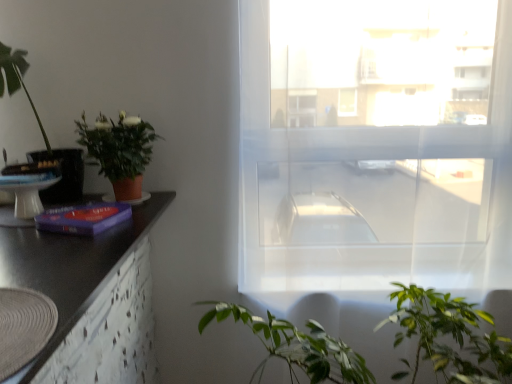
Question: From the image's perspective, does transparent fabric window at center appear higher than purple matte book at left?

Choices:
 (A) yes
 (B) no

Answer: (A)

Question: Is the depth of transparent fabric window at center greater than that of purple matte book at left?

Choices:
 (A) no
 (B) yes

Answer: (B)

Question: Does transparent fabric window at center appear on the right side of purple matte book at left?

Choices:
 (A) no
 (B) yes

Answer: (B)

Question: Is transparent fabric window at center aimed at purple matte book at left?

Choices:
 (A) no
 (B) yes

Answer: (A)

Question: From the image's perspective, is transparent fabric window at center below purple matte book at left?

Choices:
 (A) yes
 (B) no

Answer: (B)

Question: Based on their positions, is white glossy round table at left located to the left or right of matte terracotta pot at left, the 1th houseplant positioned from the right?

Choices:
 (A) left
 (B) right

Answer: (A)

Question: Is point (19, 188) closer or farther from the camera than point (97, 135)?

Choices:
 (A) closer
 (B) farther

Answer: (A)

Question: In terms of width, does white glossy round table at left look wider or thinner when compared to matte terracotta pot at left, the second houseplant in the left-to-right sequence?

Choices:
 (A) thin
 (B) wide

Answer: (A)

Question: Considering the positions of white glossy round table at left and matte terracotta pot at left, the 1th houseplant positioned from the right, in the image, is white glossy round table at left taller or shorter than matte terracotta pot at left, the 1th houseplant positioned from the right,?

Choices:
 (A) short
 (B) tall

Answer: (A)

Question: From a real-world perspective, is matte terracotta pot at left, the second houseplant in the left-to-right sequence, above or below black matte counter top at left?

Choices:
 (A) above
 (B) below

Answer: (A)

Question: Does point (104, 135) appear closer or farther from the camera than point (103, 256)?

Choices:
 (A) farther
 (B) closer

Answer: (A)

Question: Is matte terracotta pot at left, the 1th houseplant positioned from the right, wider or thinner than black matte counter top at left?

Choices:
 (A) wide
 (B) thin

Answer: (B)

Question: From the image's perspective, relative to black matte counter top at left, is matte terracotta pot at left, the second houseplant in the left-to-right sequence, above or below?

Choices:
 (A) below
 (B) above

Answer: (B)

Question: Visually, is white glossy round table at left positioned to the left or to the right of black matte counter top at left?

Choices:
 (A) left
 (B) right

Answer: (A)

Question: In terms of size, does white glossy round table at left appear bigger or smaller than black matte counter top at left?

Choices:
 (A) small
 (B) big

Answer: (A)